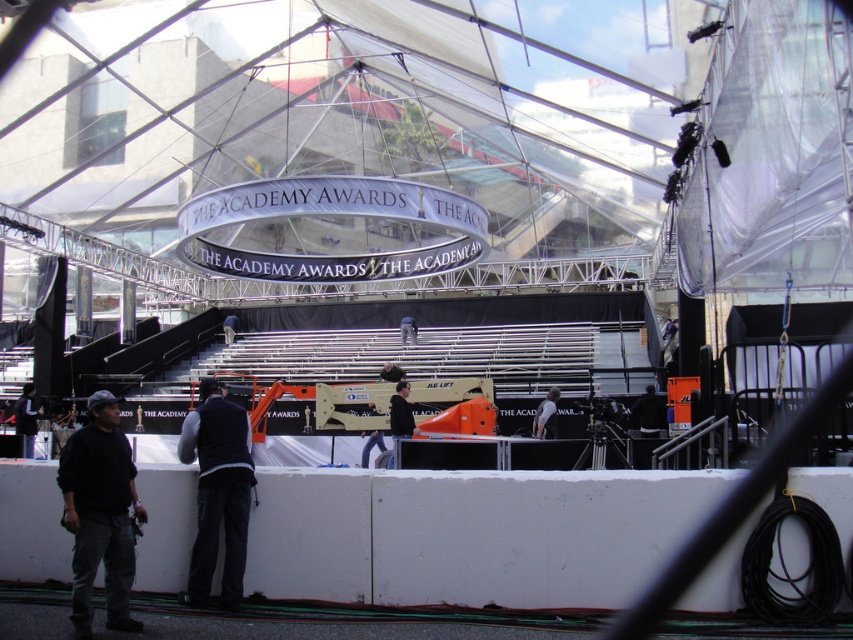
Which is in front, point (119, 413) or point (408, 419)?

Positioned in front is point (119, 413).

Is dark gray fabric jacket at lower left thinner than black matte jacket at center?

Indeed, dark gray fabric jacket at lower left has a lesser width compared to black matte jacket at center.

At what (x,y) coordinates should I click in order to perform the action: click on dark gray fabric jacket at lower left. Please return your answer as a coordinate pair (x, y). Looking at the image, I should click on (100, 513).

Image resolution: width=853 pixels, height=640 pixels. I want to click on dark gray fabric jacket at lower left, so click(100, 513).

Is white matte barrier at lower center bigger than dark gray fabric jacket at lower left?

Correct, white matte barrier at lower center is larger in size than dark gray fabric jacket at lower left.

Which is below, white matte barrier at lower center or dark gray fabric jacket at lower left?

dark gray fabric jacket at lower left is below.

Between point (366, 595) and point (86, 632), which one is positioned behind?

Point (366, 595)

You are a GUI agent. You are given a task and a screenshot of the screen. Output one action in this format:
    pyautogui.click(x=<x>, y=<y>)
    Task: Click on the white matte barrier at lower center
    
    Given the screenshot: What is the action you would take?
    pyautogui.click(x=469, y=534)

Who is more distant from viewer, (109, 444) or (209, 412)?

The point (209, 412) is behind.

Identify the location of dark gray fabric jacket at lower left. This screenshot has height=640, width=853. (100, 513).

You are a GUI agent. You are given a task and a screenshot of the screen. Output one action in this format:
    pyautogui.click(x=<x>, y=<y>)
    Task: Click on the dark gray fabric jacket at lower left
    This screenshot has width=853, height=640.
    Given the screenshot: What is the action you would take?
    pyautogui.click(x=100, y=513)